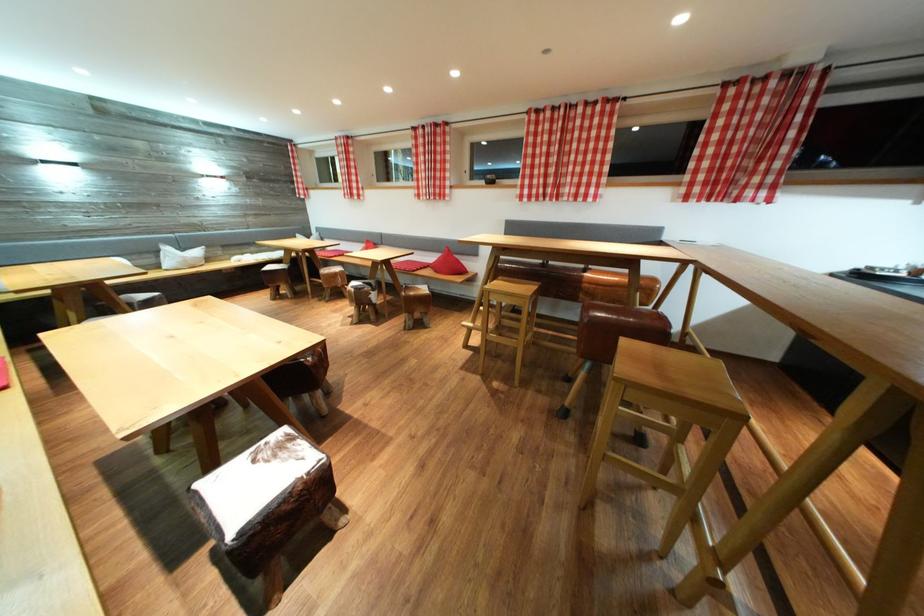
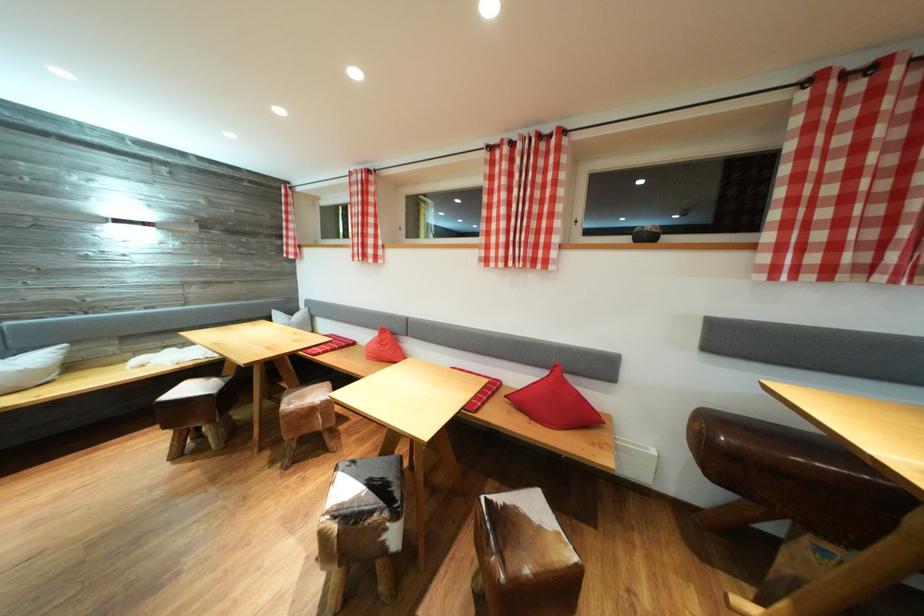
Locate, in the second image, the point that corresponds to (381,296) in the first image.

(403, 522)